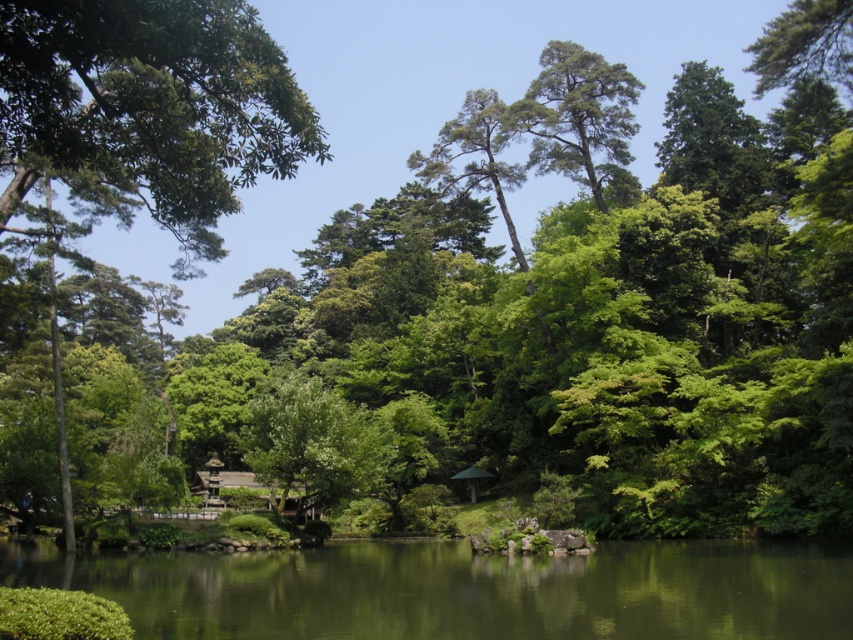
Question: Estimate the real-world distances between objects in this image. Which object is farther from the green matte tree at upper center?

Choices:
 (A) green smooth water at center
 (B) green leafy tree at upper left

Answer: (A)

Question: Which object is farther from the camera taking this photo?

Choices:
 (A) green matte tree at upper center
 (B) green leafy tree at upper left
 (C) green smooth water at center

Answer: (A)

Question: Which object is the closest to the green matte tree at upper center?

Choices:
 (A) green smooth water at center
 (B) green leafy tree at upper left

Answer: (B)

Question: Does green smooth water at center appear over green matte tree at upper center?

Choices:
 (A) no
 (B) yes

Answer: (A)

Question: Is green leafy tree at upper left positioned in front of green matte tree at upper center?

Choices:
 (A) no
 (B) yes

Answer: (B)

Question: Does green leafy tree at upper left have a larger size compared to green matte tree at upper center?

Choices:
 (A) no
 (B) yes

Answer: (B)